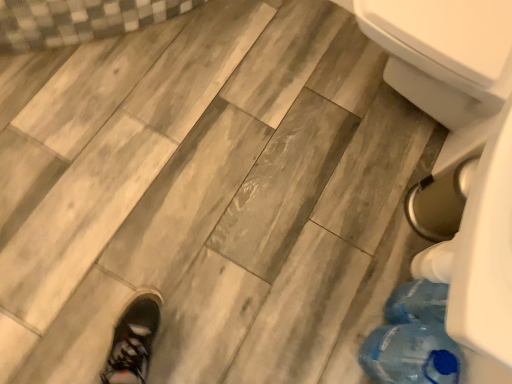
The height and width of the screenshot is (384, 512). Identify the location of vacant space in between white plastic bidet at lower right and transparent plastic bottle at lower right. (358, 206).